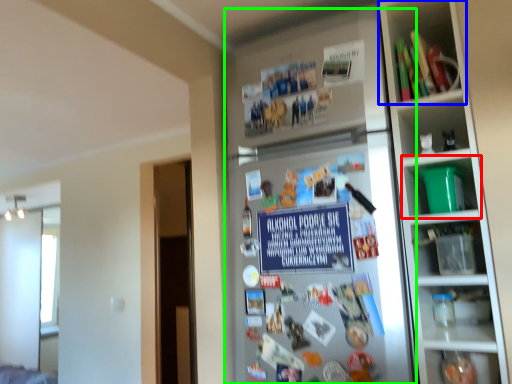
Question: Considering the real-world distances, which object is farthest from shelf (highlighted by a red box)? shelf (highlighted by a blue box) or fridge (highlighted by a green box)?

Choices:
 (A) shelf
 (B) fridge

Answer: (A)